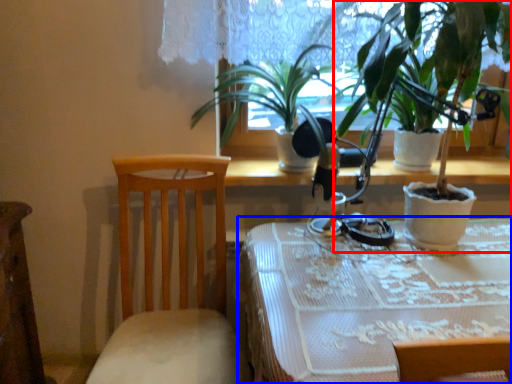
Question: Which of the following is the closest to the observer, houseplant (highlighted by a red box) or table (highlighted by a blue box)?

Choices:
 (A) houseplant
 (B) table

Answer: (B)